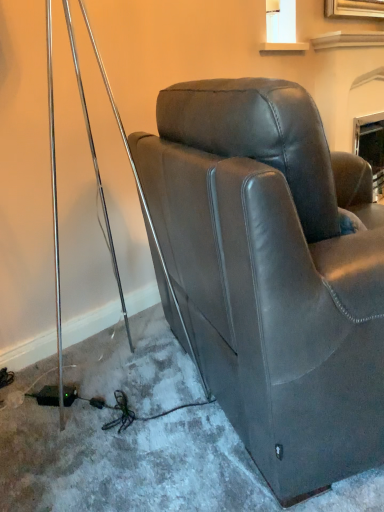
Find the location of a particular element. Image resolution: width=384 pixels, height=512 pixels. matte brown leather chair at center is located at coordinates (273, 273).

What do you see at coordinates (273, 273) in the screenshot? I see `matte brown leather chair at center` at bounding box center [273, 273].

I want to click on matte brown leather chair at center, so click(x=273, y=273).